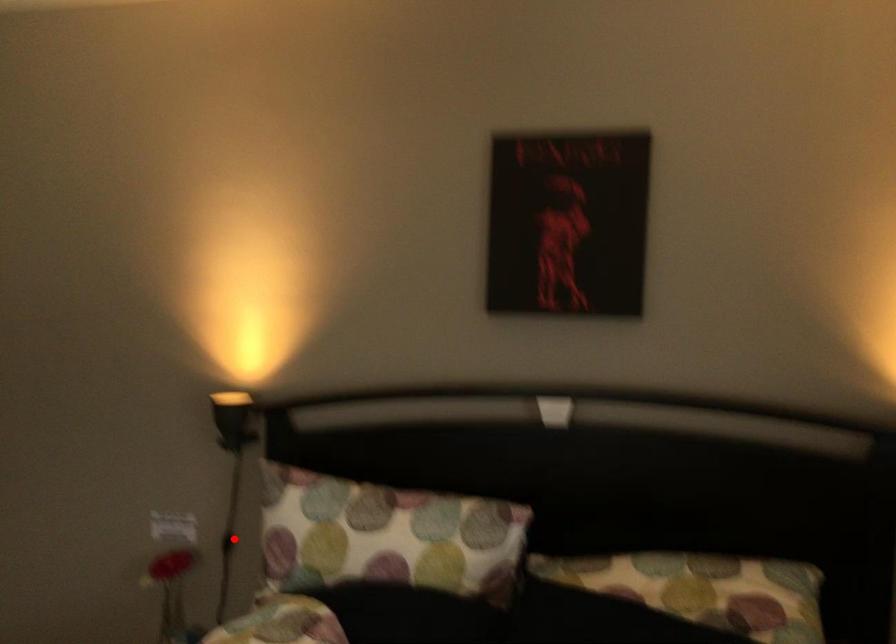
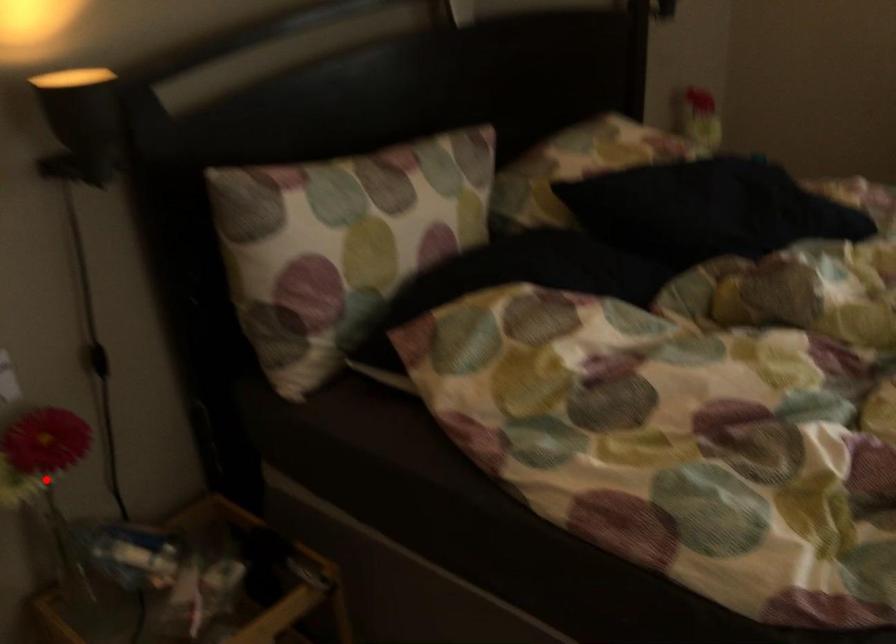
I am providing you with two images of the same scene from different viewpoints. A red point is marked on the first image and another point is marked on the second image. Is the red point in image1 aligned with the point shown in image2?

No